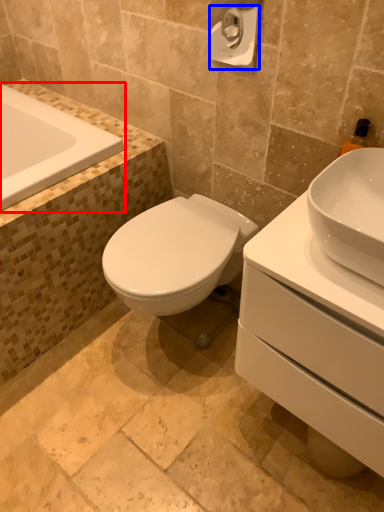
Question: Among these objects, which one is farthest to the camera, bathtub (highlighted by a red box) or toilet paper (highlighted by a blue box)?

Choices:
 (A) bathtub
 (B) toilet paper

Answer: (A)